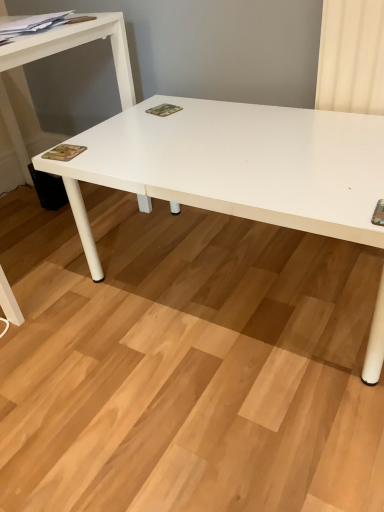
Question: Does white matte table at left touch camouflage paper at lower left, which appears as the 2th magazine when viewed from the right?

Choices:
 (A) yes
 (B) no

Answer: (B)

Question: Could camouflage paper at lower left, the third magazine when ordered from top to bottom, be considered to be inside white matte table at left?

Choices:
 (A) no
 (B) yes

Answer: (A)

Question: Is white matte table at left to the right of camouflage paper at lower left, which appears as the 2th magazine when viewed from the right, from the viewer's perspective?

Choices:
 (A) no
 (B) yes

Answer: (A)

Question: Does white matte table at left have a smaller size compared to camouflage paper at lower left, the 1th magazine in the bottom-to-top sequence?

Choices:
 (A) no
 (B) yes

Answer: (A)

Question: Considering the relative sizes of white matte table at left and camouflage paper at lower left, which appears as the 2th magazine when viewed from the right, in the image provided, is white matte table at left wider than camouflage paper at lower left, which appears as the 2th magazine when viewed from the right,?

Choices:
 (A) yes
 (B) no

Answer: (A)

Question: From the image's perspective, is matte paper magazine at upper left, the third magazine when ordered from bottom to top, above or below camouflage fabric magazine at center, placed as the 1th magazine when sorted from right to left?

Choices:
 (A) above
 (B) below

Answer: (A)

Question: Does point (18, 18) appear closer or farther from the camera than point (162, 111)?

Choices:
 (A) closer
 (B) farther

Answer: (B)

Question: Is matte paper magazine at upper left, which is the 1th magazine from top to bottom, inside the boundaries of camouflage fabric magazine at center, the third magazine when ordered from left to right, or outside?

Choices:
 (A) inside
 (B) outside

Answer: (B)

Question: From a real-world perspective, is matte paper magazine at upper left, the first magazine positioned from the left, positioned above or below camouflage fabric magazine at center, placed as the 1th magazine when sorted from right to left?

Choices:
 (A) above
 (B) below

Answer: (A)

Question: Is point (69, 151) positioned closer to the camera than point (61, 14)?

Choices:
 (A) farther
 (B) closer

Answer: (B)

Question: Is camouflage paper at lower left, the third magazine when ordered from top to bottom, wider or thinner than matte paper magazine at upper left, the first magazine positioned from the left?

Choices:
 (A) thin
 (B) wide

Answer: (A)

Question: Considering their positions, is camouflage paper at lower left, which appears as the 2th magazine when viewed from the right, located in front of or behind matte paper magazine at upper left, which is the third magazine from right to left?

Choices:
 (A) front
 (B) behind

Answer: (B)

Question: From the image's perspective, relative to matte paper magazine at upper left, the third magazine when ordered from bottom to top, is camouflage paper at lower left, which appears as the 2th magazine when viewed from the right, above or below?

Choices:
 (A) above
 (B) below

Answer: (B)

Question: From the image's perspective, is camouflage paper at lower left, which appears as the 2th magazine when viewed from the right, above or below camouflage fabric magazine at center, placed as the 1th magazine when sorted from right to left?

Choices:
 (A) above
 (B) below

Answer: (B)

Question: Considering their positions, is camouflage paper at lower left, the third magazine when ordered from top to bottom, located in front of or behind camouflage fabric magazine at center, the 2th magazine in the top-to-bottom sequence?

Choices:
 (A) behind
 (B) front

Answer: (B)